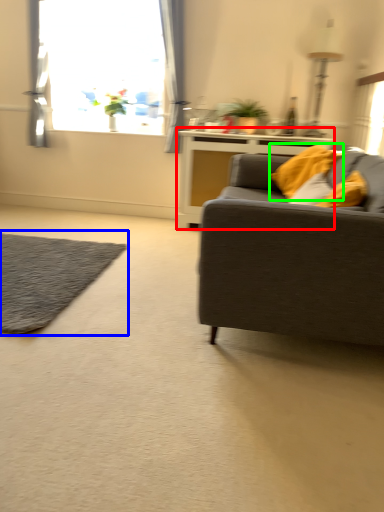
Question: Which object is positioned farthest from table (highlighted by a red box)? Select from mat (highlighted by a blue box) and pillow (highlighted by a green box).

Choices:
 (A) mat
 (B) pillow

Answer: (A)